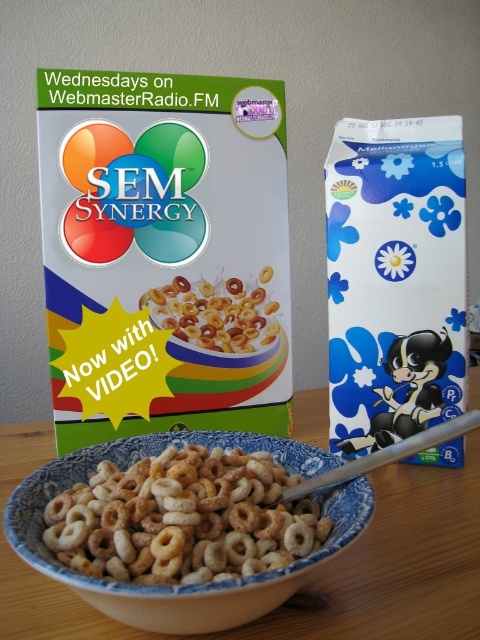
Does point (72, 456) come farther from viewer compared to point (218, 342)?

No, it is in front of (218, 342).

Find the location of a particular element. The image size is (480, 640). blue ceramic bowl at center is located at coordinates (190, 586).

Consider the image. Which is more to the left, matte cardboard cereal box at center or blue ceramic bowl at center?

matte cardboard cereal box at center is more to the left.

The height and width of the screenshot is (640, 480). What do you see at coordinates (170, 237) in the screenshot?
I see `matte cardboard cereal box at center` at bounding box center [170, 237].

Locate an element on the screen. Image resolution: width=480 pixels, height=640 pixels. matte cardboard cereal box at center is located at coordinates (x=170, y=237).

Is the position of blue glossy milk carton at right more distant than that of golden matte cereal rings at center?

No, blue glossy milk carton at right is in front of golden matte cereal rings at center.

What do you see at coordinates (395, 278) in the screenshot? The image size is (480, 640). I see `blue glossy milk carton at right` at bounding box center [395, 278].

Where is `blue glossy milk carton at right`? The image size is (480, 640). blue glossy milk carton at right is located at coordinates (395, 278).